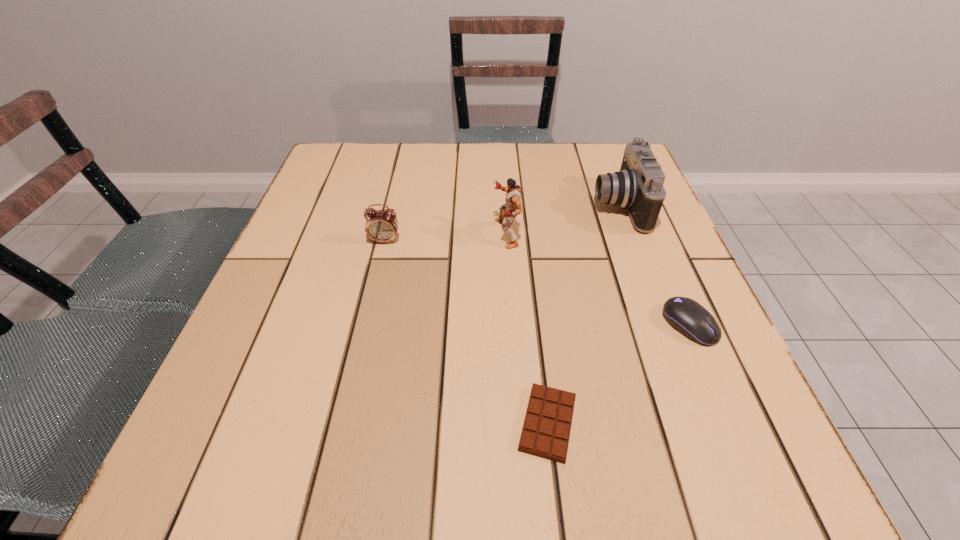
The height and width of the screenshot is (540, 960). I want to click on free space between the alarm clock and the nearest object, so click(x=467, y=332).

The height and width of the screenshot is (540, 960). Identify the location of free space between the puncher and the leftmost object. (445, 237).

Locate an element on the screen. This screenshot has height=540, width=960. vacant area that lies between the shortest object and the third tallest object is located at coordinates (467, 332).

You are a GUI agent. You are given a task and a screenshot of the screen. Output one action in this format:
    pyautogui.click(x=<x>, y=<y>)
    Task: Click on the free space between the computer mouse and the leftmost object
    This screenshot has height=540, width=960.
    Given the screenshot: What is the action you would take?
    pyautogui.click(x=538, y=282)

Where is `vacant area between the puncher and the camera`? The width and height of the screenshot is (960, 540). vacant area between the puncher and the camera is located at coordinates (563, 220).

Image resolution: width=960 pixels, height=540 pixels. I want to click on vacant space in between the nearest object and the leftmost object, so click(467, 332).

You are a GUI agent. You are given a task and a screenshot of the screen. Output one action in this format:
    pyautogui.click(x=<x>, y=<y>)
    Task: Click on the vacant space that is in between the camera and the leftmost object
    Image resolution: width=960 pixels, height=540 pixels.
    Given the screenshot: What is the action you would take?
    pyautogui.click(x=502, y=223)

Locate an element on the screen. The height and width of the screenshot is (540, 960). unoccupied area between the candy bar and the leftmost object is located at coordinates (467, 332).

Image resolution: width=960 pixels, height=540 pixels. Find the location of `object that stands as the fourth closest to the camera`. object that stands as the fourth closest to the camera is located at coordinates (381, 225).

In order to click on object that is the second closest one to the puncher in this screenshot , I will do `click(381, 225)`.